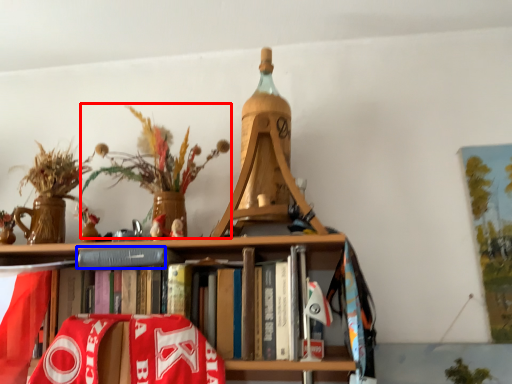
Question: Which object appears closest to the camera in this image, floral arrangement (highlighted by a red box) or paperback book (highlighted by a blue box)?

Choices:
 (A) floral arrangement
 (B) paperback book

Answer: (A)